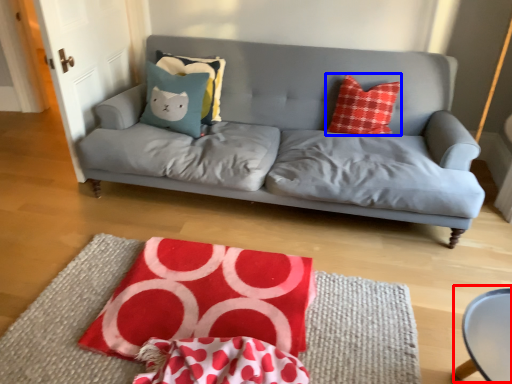
Question: Among these objects, which one is farthest to the camera, round table (highlighted by a red box) or throw pillow (highlighted by a blue box)?

Choices:
 (A) round table
 (B) throw pillow

Answer: (B)